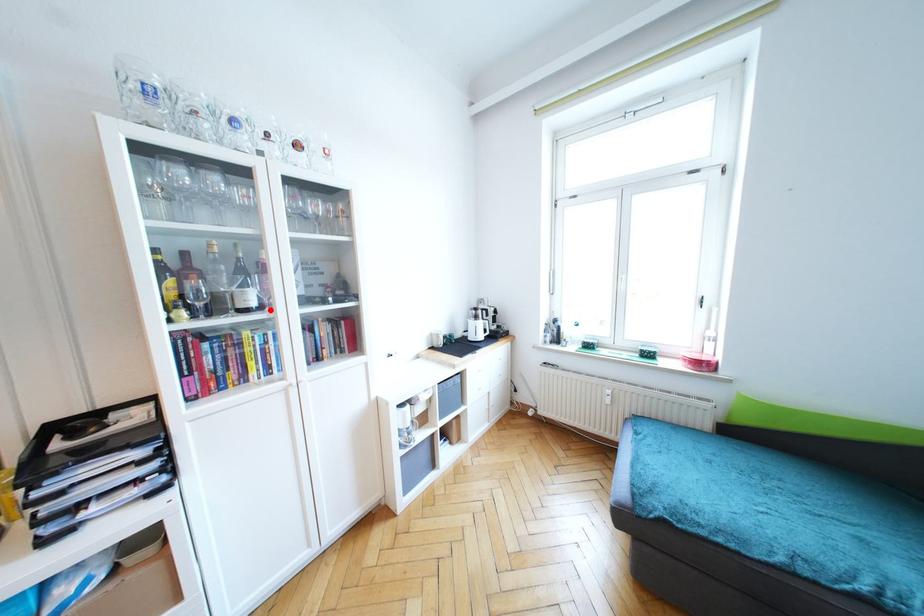
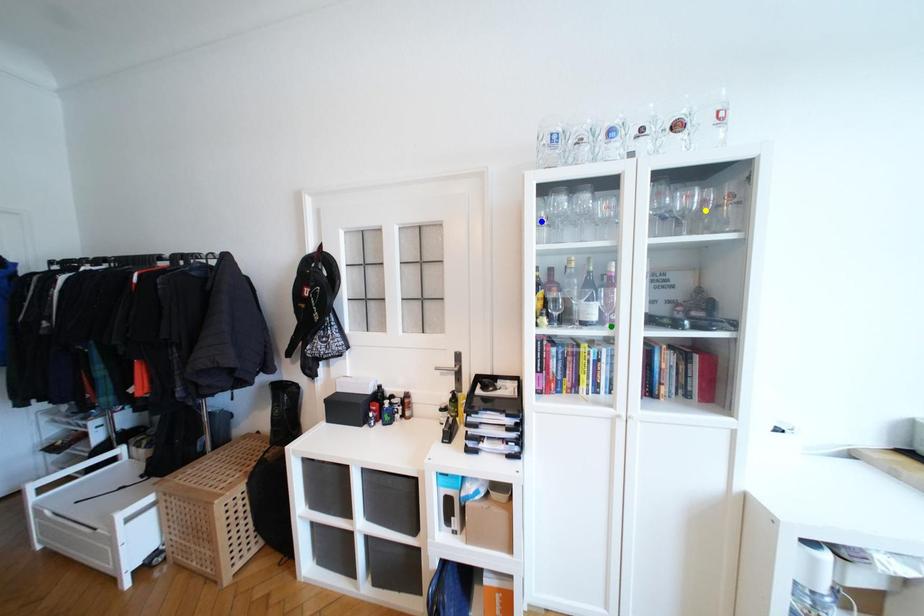
Question: I am providing you with two images of the same scene from different viewpoints. A red point is marked on the first image. You are given multiple points on the second image. Which spot in image 2 lines up with the point in image 1?

Choices:
 (A) yellow point
 (B) green point
 (C) blue point

Answer: (B)